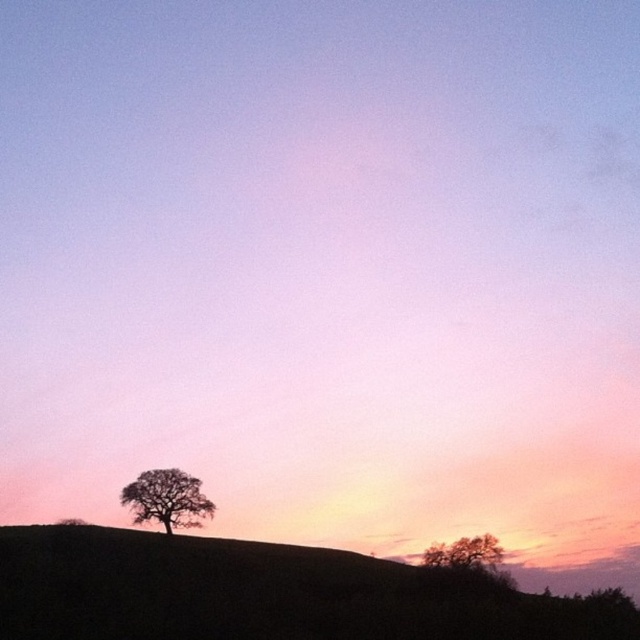
Is silhouette grass at lower left further to camera compared to smooth brown tree at lower right?

No, silhouette grass at lower left is in front of smooth brown tree at lower right.

Where is `silhouette grass at lower left`? silhouette grass at lower left is located at coordinates (266, 593).

Identify the location of silhouette grass at lower left. click(266, 593).

Is silhouette grass at lower left shorter than silhouette leafy tree at lower left?

In fact, silhouette grass at lower left may be taller than silhouette leafy tree at lower left.

Can you confirm if silhouette grass at lower left is thinner than silhouette leafy tree at lower left?

No.

What are the coordinates of `silhouette grass at lower left` in the screenshot? It's located at (266, 593).

Is silhouette leafy tree at lower left positioned at the back of smooth brown tree at lower right?

Yes, it is behind smooth brown tree at lower right.

Which is above, silhouette leafy tree at lower left or smooth brown tree at lower right?

silhouette leafy tree at lower left is higher up.

Consider the image. Who is more distant from viewer, (196,483) or (429,547)?

The point (196,483) is behind.

At what (x,y) coordinates should I click in order to perform the action: click on silhouette leafy tree at lower left. Please return your answer as a coordinate pair (x, y). Image resolution: width=640 pixels, height=640 pixels. Looking at the image, I should click on (168, 499).